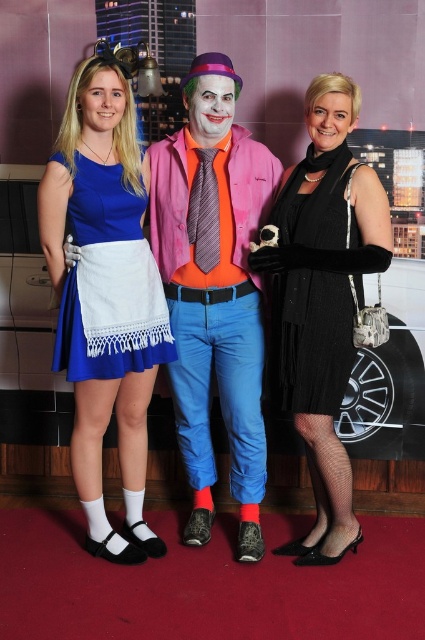
Question: From the image, what is the correct spatial relationship of blue cotton dress at left in relation to blue cotton dress at center?

Choices:
 (A) left
 (B) right

Answer: (B)

Question: Which object is positioned farthest from the pink fabric clown costume at center?

Choices:
 (A) blue cotton dress at center
 (B) black textured dress at center
 (C) black knitted dress at right

Answer: (A)

Question: Can you confirm if pink fabric clown costume at center is positioned to the left of blue cotton dress at center?

Choices:
 (A) no
 (B) yes

Answer: (A)

Question: Which point is closer to the camera?

Choices:
 (A) (342, 248)
 (B) (73, 182)
 (C) (96, 422)
 (D) (176, 246)

Answer: (B)

Question: Which of these objects is positioned farthest from the blue cotton dress at center?

Choices:
 (A) black knitted dress at right
 (B) pink fabric clown costume at center
 (C) blue cotton dress at left

Answer: (A)

Question: Considering the relative positions of blue cotton dress at left and black textured dress at center in the image provided, where is blue cotton dress at left located with respect to black textured dress at center?

Choices:
 (A) right
 (B) left

Answer: (B)